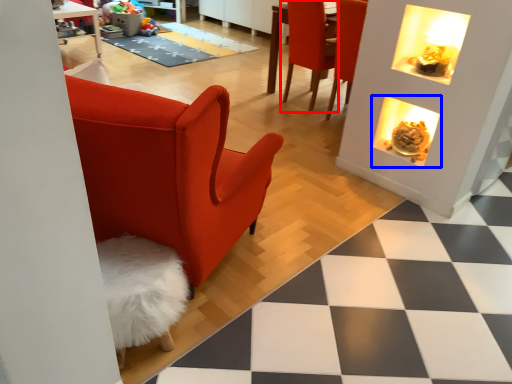
Question: Which object is further to the camera taking this photo, chair (highlighted by a red box) or fireplace (highlighted by a blue box)?

Choices:
 (A) chair
 (B) fireplace

Answer: (A)